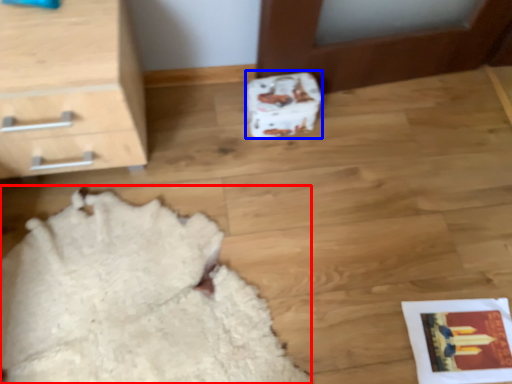
Question: Which point is further to the camera, blanket (highlighted by a red box) or shoe box (highlighted by a blue box)?

Choices:
 (A) blanket
 (B) shoe box

Answer: (B)